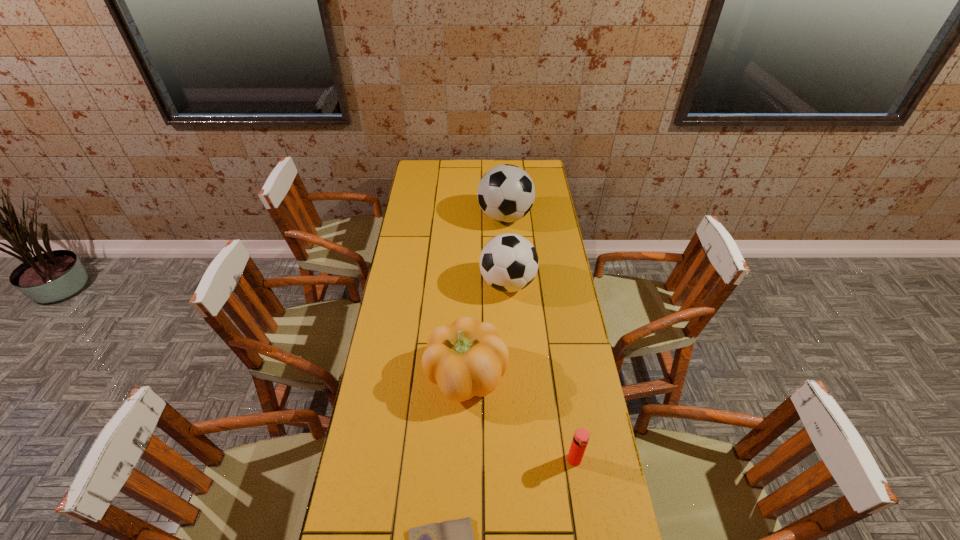
Identify the location of vacant space that satisfies the following two spatial constraints: 1. on the back side of the farther soccer ball; 2. on the left side of the shorter soccer ball. The height and width of the screenshot is (540, 960). (503, 217).

This screenshot has width=960, height=540. What are the coordinates of `vacant region that satisfies the following two spatial constraints: 1. on the back side of the pumpkin; 2. on the left side of the fourth nearest object` in the screenshot? It's located at (468, 284).